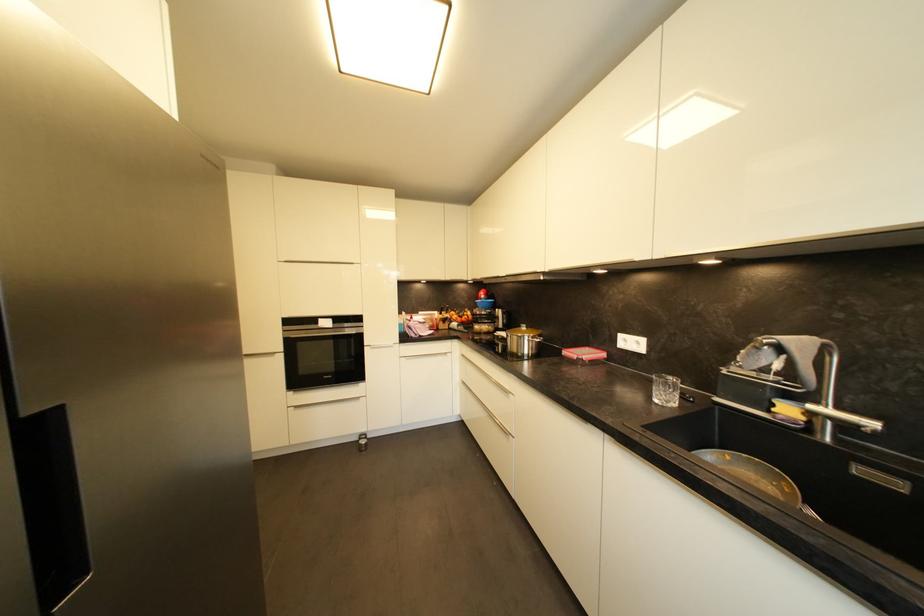
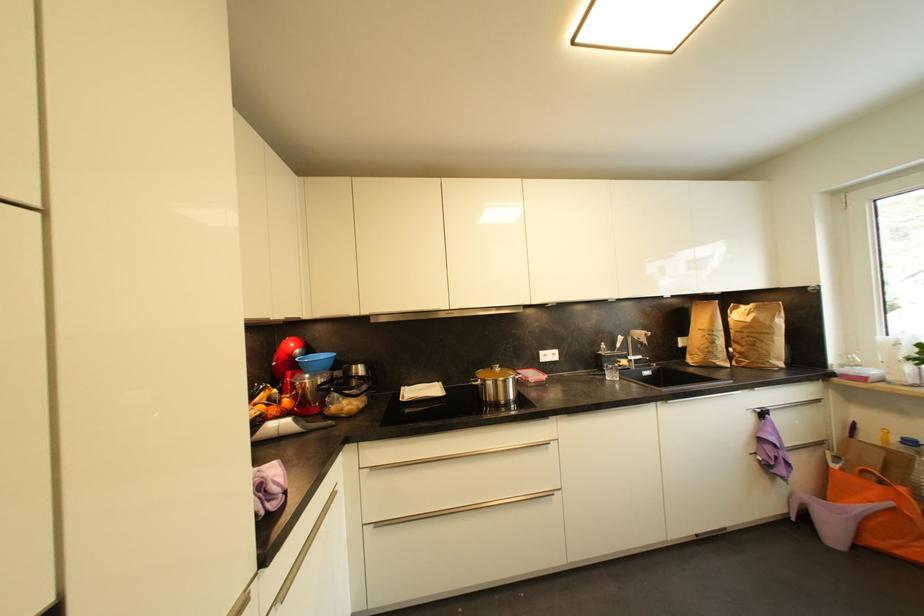
In the second image, find the point that corresponds to (602,350) in the first image.

(528, 371)